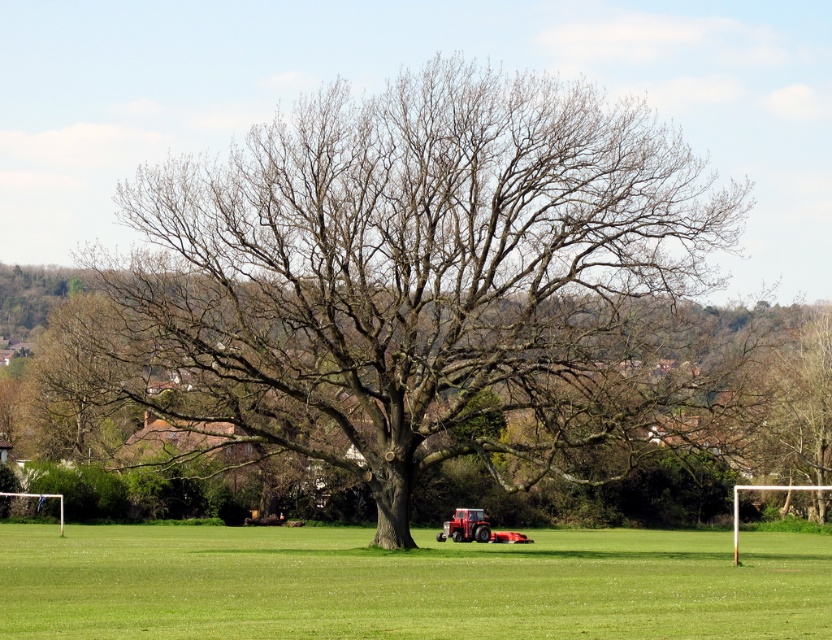
You are a gardener planning to mow the green grass at center. The mower you have can only handle areas smaller than the bare branches at center. Will the mower be sufficient for the task?

The bare branches at center has a smaller size compared to green grass at center. Therefore, the mower will not be sufficient since the green grass at center is larger than the area the mower can handle.

You are standing at the origin point of the coordinate system in the field. The tractor is parked near the base of the tree with bare branches at center. If you want to walk directly to the tractor, which direction should you head towards?

You should head towards the direction of the bare branches at center since the tractor is parked near its base.

You are a gardener planning to plant flowers between the bare branches at center and the green grass at center. Which area has a narrower space for planting?

The bare branches at center is thinner than the green grass at center, so the area around the bare branches at center has a narrower space for planting flowers.